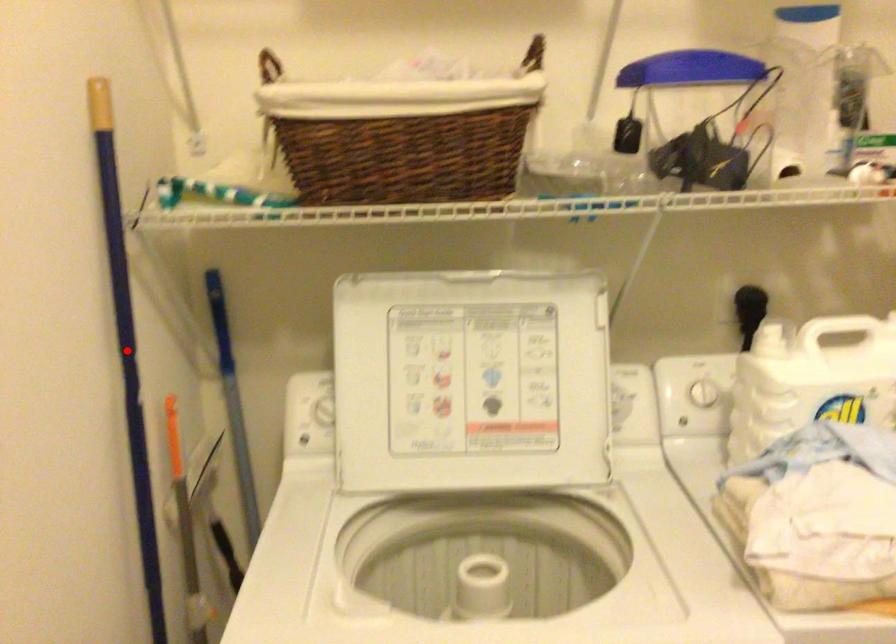
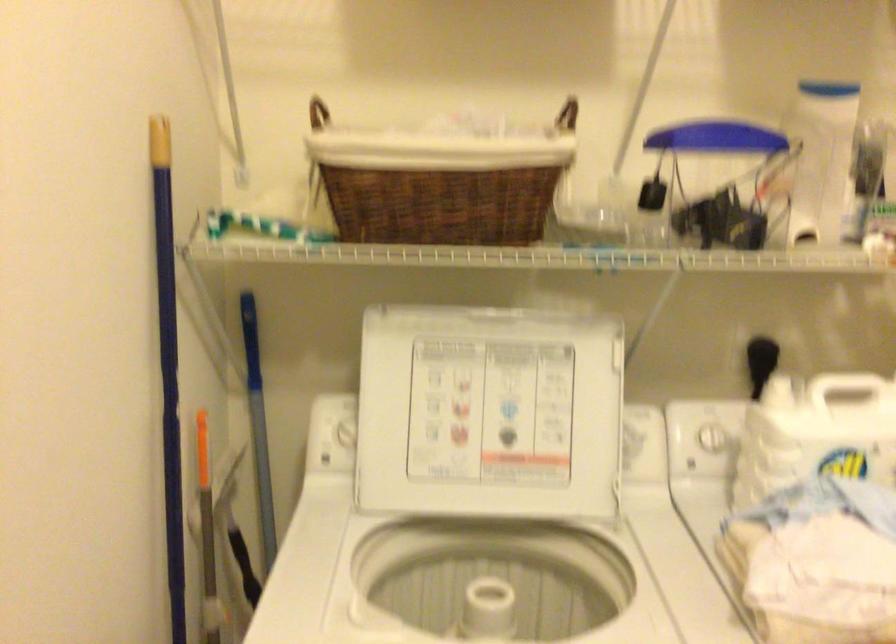
Locate, in the second image, the point that corresponds to the highlighted location in the first image.

(168, 366)